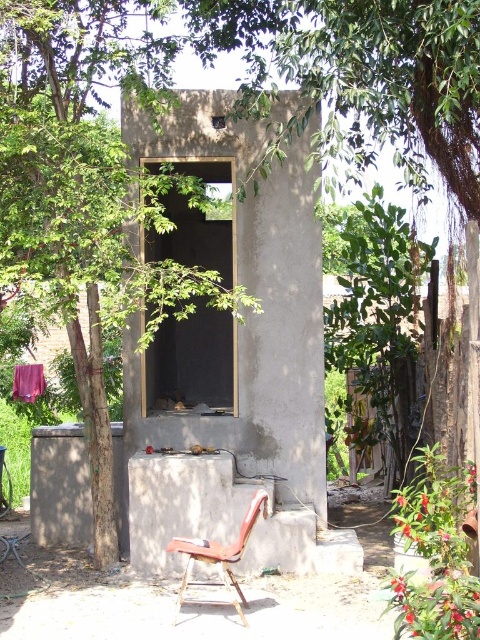
Can you confirm if green leafy tree at right is positioned to the right of purple fabric at center?

Correct, you'll find green leafy tree at right to the right of purple fabric at center.

Between point (398, 376) and point (33, 378), which one is positioned behind?

The point (33, 378) is behind.

Image resolution: width=480 pixels, height=640 pixels. In order to click on green leafy tree at right in this screenshot , I will do `click(380, 324)`.

Is green leafy tree at center thinner than gray concrete wall at lower left?

In fact, green leafy tree at center might be wider than gray concrete wall at lower left.

Is the position of green leafy tree at center more distant than that of gray concrete wall at lower left?

No, green leafy tree at center is closer to the viewer.

The image size is (480, 640). What do you see at coordinates (85, 189) in the screenshot?
I see `green leafy tree at center` at bounding box center [85, 189].

Find the location of a particular element. The width and height of the screenshot is (480, 640). green leafy tree at center is located at coordinates (85, 189).

Can you confirm if green leafy tree at center is taller than metallic red chair at lower center?

Indeed, green leafy tree at center has a greater height compared to metallic red chair at lower center.

Does green leafy tree at center appear on the right side of metallic red chair at lower center?

In fact, green leafy tree at center is to the left of metallic red chair at lower center.

Is point (191, 180) less distant than point (264, 512)?

Yes, it is in front of point (264, 512).

This screenshot has height=640, width=480. What are the coordinates of `green leafy tree at center` in the screenshot? It's located at (85, 189).